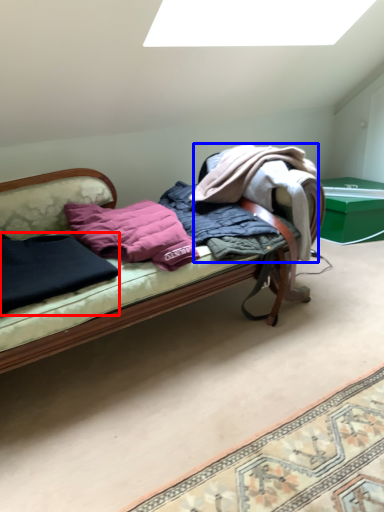
Question: Which point is closer to the camera, clothing (highlighted by a red box) or clothing (highlighted by a blue box)?

Choices:
 (A) clothing
 (B) clothing

Answer: (A)